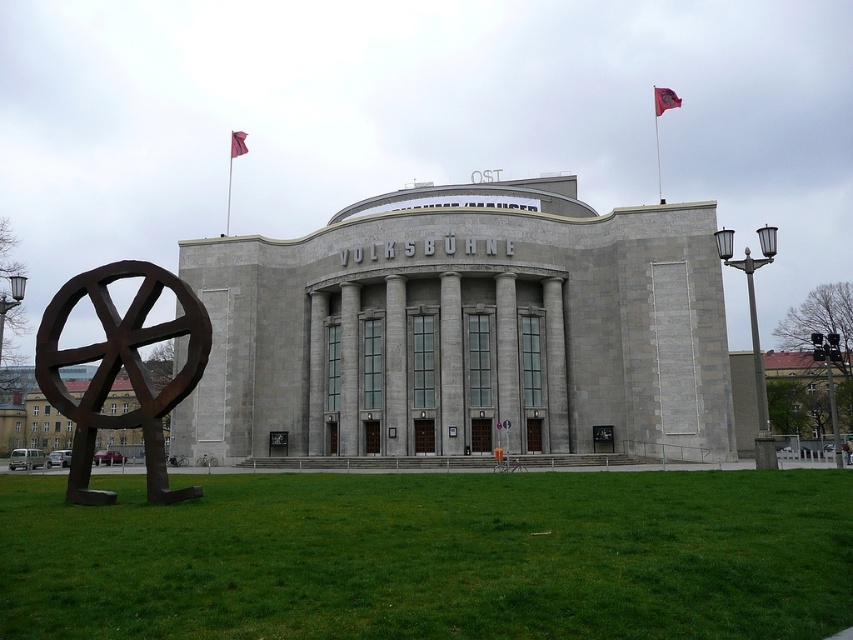
Is green grass at lower center taller than rusty metal sculpture at center?

Incorrect, green grass at lower center's height is not larger of rusty metal sculpture at center's.

Can you confirm if green grass at lower center is positioned below rusty metal sculpture at center?

Correct, green grass at lower center is located below rusty metal sculpture at center.

This screenshot has width=853, height=640. Identify the location of green grass at lower center. (433, 556).

What do you see at coordinates (664, 99) in the screenshot? I see `red fabric flag at upper right` at bounding box center [664, 99].

Who is positioned more to the right, red fabric flag at upper right or red fabric flag at upper center?

Positioned to the right is red fabric flag at upper right.

Is point (662, 92) positioned after point (239, 141)?

Yes, point (662, 92) is behind point (239, 141).

In order to click on red fabric flag at upper right in this screenshot , I will do pyautogui.click(x=664, y=99).

Does point (332, 595) lie in front of point (236, 148)?

That is True.

Does green grass at lower center have a greater height compared to red fabric flag at upper center?

No.

Measure the distance between point (235, 596) and camera.

Point (235, 596) and camera are 19.01 meters apart.

The width and height of the screenshot is (853, 640). I want to click on green grass at lower center, so click(433, 556).